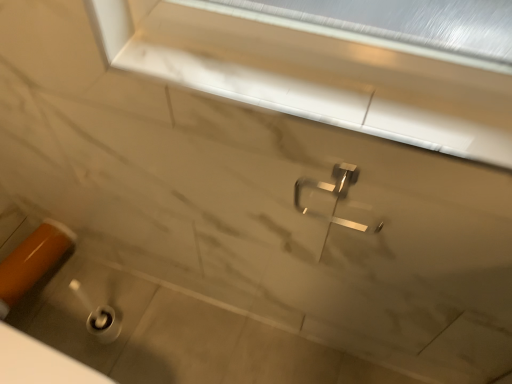
Question: Is white marble window frame at upper center aimed at polished metallic tap at center?

Choices:
 (A) yes
 (B) no

Answer: (B)

Question: From the image's perspective, would you say white marble window frame at upper center is shown under polished metallic tap at center?

Choices:
 (A) no
 (B) yes

Answer: (A)

Question: Does white marble window frame at upper center have a smaller size compared to polished metallic tap at center?

Choices:
 (A) no
 (B) yes

Answer: (A)

Question: From the image's perspective, is white marble window frame at upper center above polished metallic tap at center?

Choices:
 (A) yes
 (B) no

Answer: (A)

Question: Can you confirm if white marble window frame at upper center is positioned to the left of polished metallic tap at center?

Choices:
 (A) yes
 (B) no

Answer: (A)

Question: In terms of width, does polished metallic tap at center look wider or thinner when compared to orange glossy door handle at lower left?

Choices:
 (A) wide
 (B) thin

Answer: (B)

Question: Is polished metallic tap at center taller or shorter than orange glossy door handle at lower left?

Choices:
 (A) tall
 (B) short

Answer: (A)

Question: Looking at the image, does polished metallic tap at center seem bigger or smaller compared to orange glossy door handle at lower left?

Choices:
 (A) big
 (B) small

Answer: (B)

Question: Visually, is polished metallic tap at center positioned to the left or to the right of orange glossy door handle at lower left?

Choices:
 (A) left
 (B) right

Answer: (B)

Question: From the image's perspective, relative to polished metallic tap at center, is white marble window frame at upper center above or below?

Choices:
 (A) below
 (B) above

Answer: (B)

Question: From a real-world perspective, relative to polished metallic tap at center, is white marble window frame at upper center vertically above or below?

Choices:
 (A) below
 (B) above

Answer: (B)

Question: Considering the positions of white marble window frame at upper center and polished metallic tap at center in the image, is white marble window frame at upper center bigger or smaller than polished metallic tap at center?

Choices:
 (A) small
 (B) big

Answer: (B)

Question: Considering the positions of point (175, 79) and point (336, 162), is point (175, 79) closer or farther from the camera than point (336, 162)?

Choices:
 (A) farther
 (B) closer

Answer: (B)

Question: In the image, is polished metallic tap at center on the left side or the right side of white marble window frame at upper center?

Choices:
 (A) right
 (B) left

Answer: (A)

Question: Considering their positions, is polished metallic tap at center located in front of or behind white marble window frame at upper center?

Choices:
 (A) behind
 (B) front

Answer: (A)